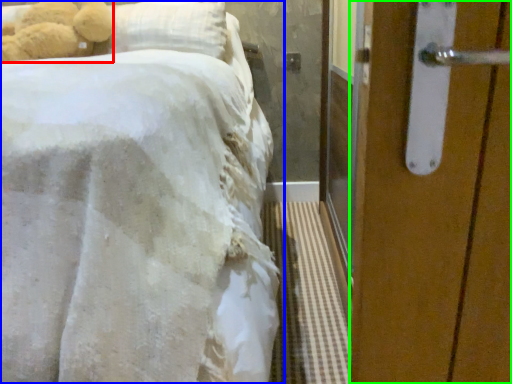
Question: Considering the real-world distances, which object is farthest from teddy bear (highlighted by a red box)? bed (highlighted by a blue box) or door (highlighted by a green box)?

Choices:
 (A) bed
 (B) door

Answer: (B)